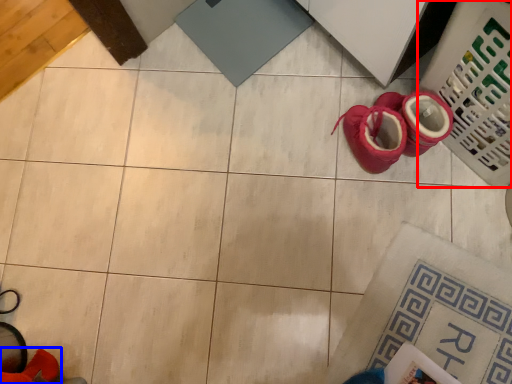
Question: Which of the following is the closest to the observer, laundry basket (highlighted by a red box) or footwear (highlighted by a blue box)?

Choices:
 (A) laundry basket
 (B) footwear

Answer: (B)